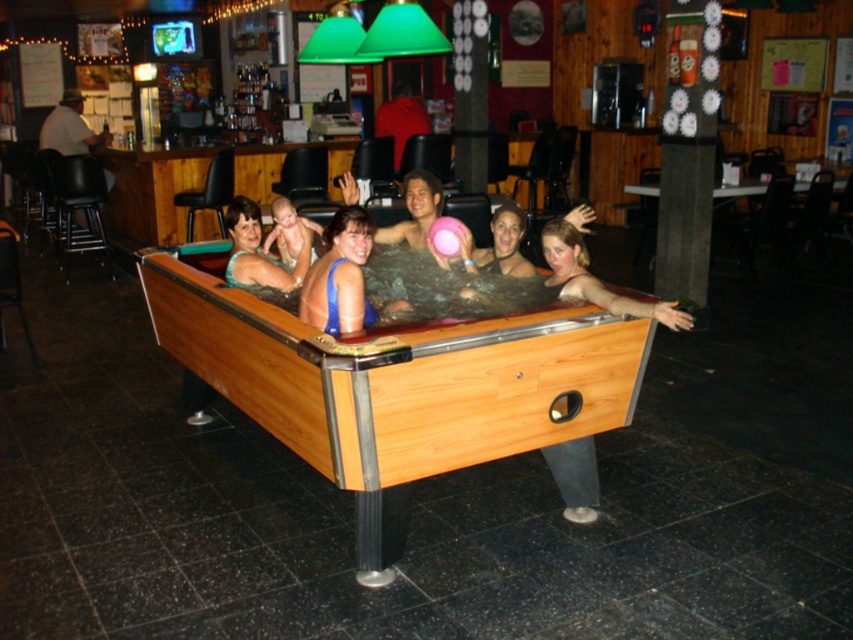
You are standing in the bar and want to take a photo of both the wooden pool table at center and the matte blue swimsuit at center. Since you have a camera with a limited depth of field, which object should you focus on to ensure the other remains in the background?

You should focus on the wooden pool table at center because it is closer to the viewer than the matte blue swimsuit at center, so the swimsuit will naturally be in the background.

You are a photographer standing in the bar and want to take a picture of the wooden pool table at center and the matte blue swimsuit at center. From your current position, which object is located to the right side?

The wooden pool table at center is located to the right of the matte blue swimsuit at center, so the wooden pool table at center is on the right side.

You are a photographer standing at the entrance of the bar. You want to capture a photo of the wooden pool table at center and the matte blue swimsuit at center. How far apart are these two objects in feet?

The wooden pool table at center is 27.62 inches from matte blue swimsuit at center, which is approximately 2.3 feet. Therefore, the distance between them is about 2.3 feet.